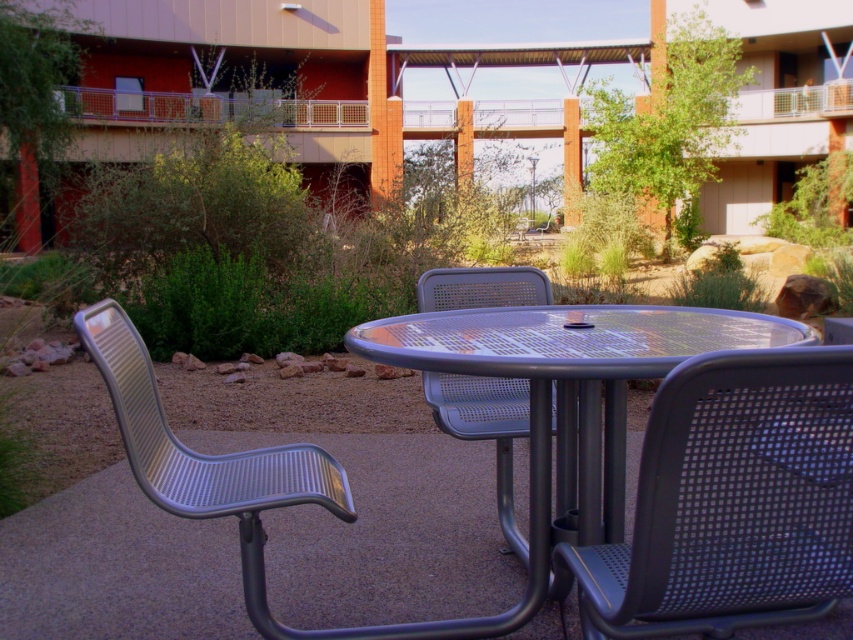
Question: Considering the real-world distances, which object is farthest from the metal mesh chair at center?

Choices:
 (A) metallic mesh chair at left
 (B) metallic mesh table at center

Answer: (A)

Question: Is black mesh chair at lower right further to the viewer compared to metallic mesh table at center?

Choices:
 (A) no
 (B) yes

Answer: (A)

Question: Is black mesh chair at lower right behind metallic mesh chair at left?

Choices:
 (A) yes
 (B) no

Answer: (B)

Question: Based on their relative distances, which object is farther from the metallic mesh chair at left?

Choices:
 (A) black mesh chair at lower right
 (B) metallic mesh table at center

Answer: (A)

Question: Can you confirm if metallic mesh table at center is positioned to the right of metallic mesh chair at left?

Choices:
 (A) no
 (B) yes

Answer: (B)

Question: Among these points, which one is nearest to the camera?

Choices:
 (A) (815, 515)
 (B) (169, 451)
 (C) (454, 369)

Answer: (A)